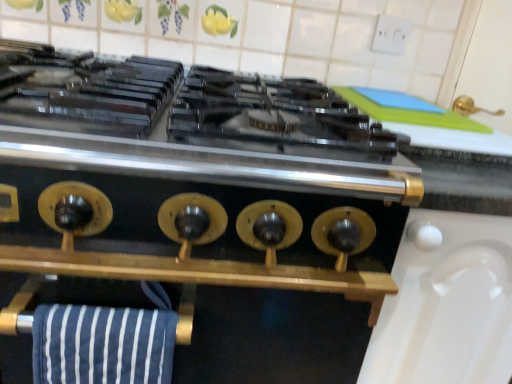
Question: From the image's perspective, is blue striped towel at lower left positioned above or below gold metallic stove knobs at center?

Choices:
 (A) below
 (B) above

Answer: (B)

Question: Visually, is blue striped towel at lower left positioned to the left or to the right of gold metallic stove knobs at center?

Choices:
 (A) right
 (B) left

Answer: (A)

Question: Is blue striped towel at lower left in front of or behind gold metallic stove knobs at center in the image?

Choices:
 (A) behind
 (B) front

Answer: (A)

Question: In terms of width, does gold metallic stove knobs at center look wider or thinner when compared to blue striped towel at lower left?

Choices:
 (A) wide
 (B) thin

Answer: (A)

Question: From the image's perspective, is gold metallic stove knobs at center located above or below blue striped towel at lower left?

Choices:
 (A) above
 (B) below

Answer: (B)

Question: From a real-world perspective, is gold metallic stove knobs at center above or below blue striped towel at lower left?

Choices:
 (A) below
 (B) above

Answer: (A)

Question: Which is correct: gold metallic stove knobs at center is inside blue striped towel at lower left, or outside of it?

Choices:
 (A) inside
 (B) outside

Answer: (B)